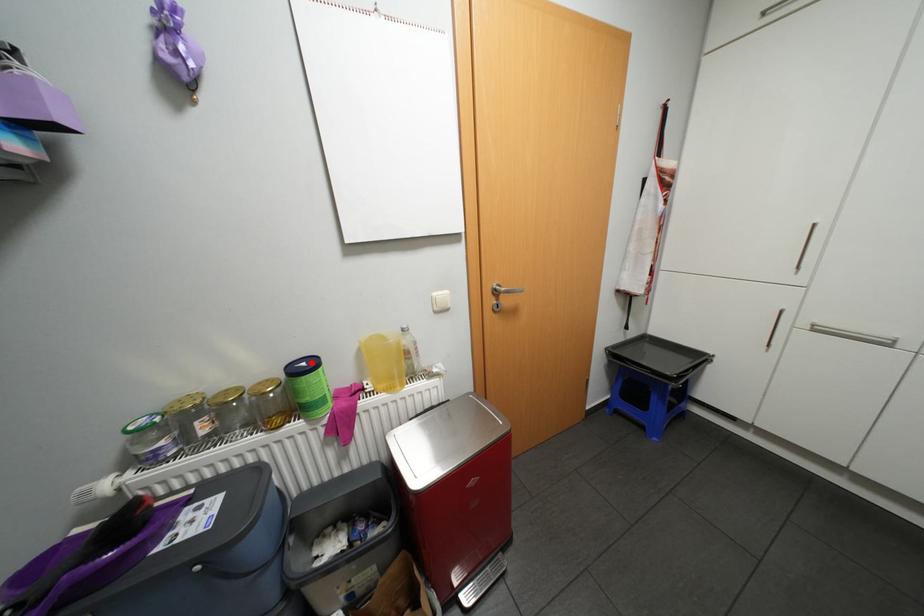
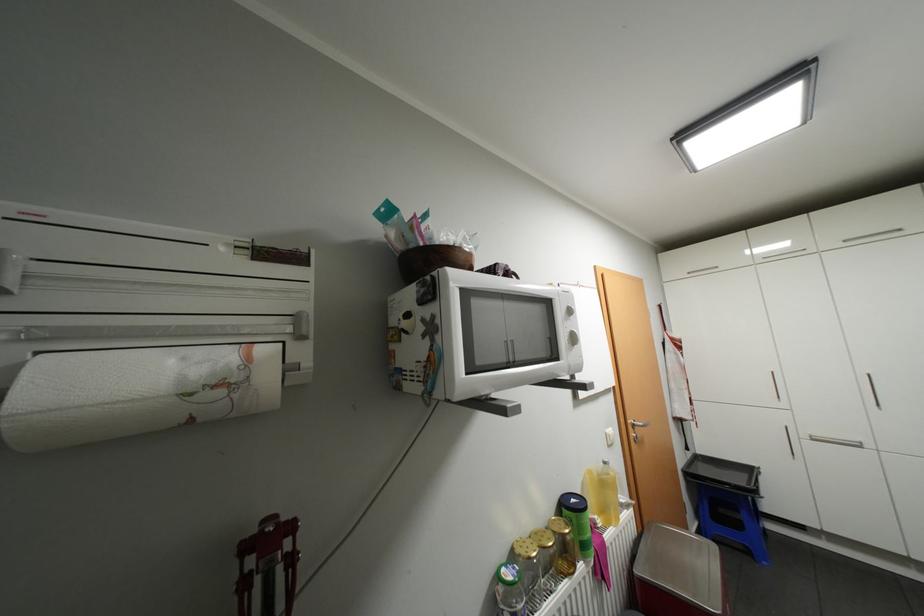
In the second image, find the point that corresponds to the highlighted location in the first image.

(580, 499)